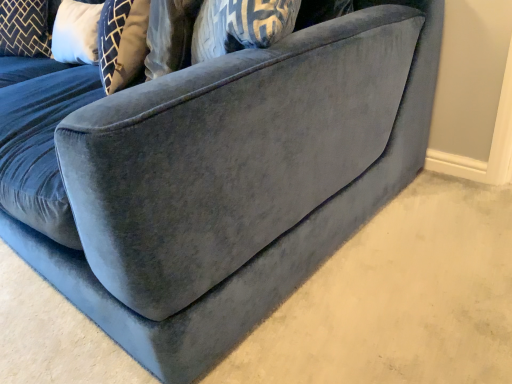
The width and height of the screenshot is (512, 384). Describe the element at coordinates (24, 28) in the screenshot. I see `white cotton pillow at upper left` at that location.

Locate an element on the screen. Image resolution: width=512 pixels, height=384 pixels. white cotton pillow at upper left is located at coordinates (24, 28).

Where is `white cotton pillow at upper left`? This screenshot has width=512, height=384. white cotton pillow at upper left is located at coordinates (24, 28).